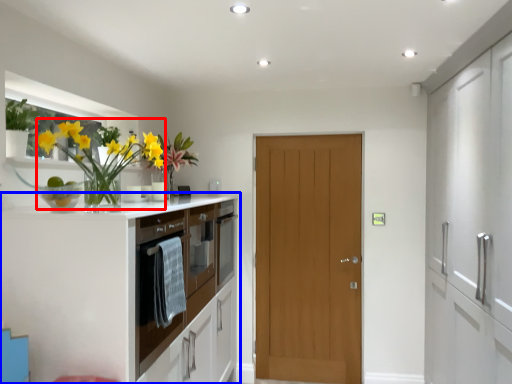
Question: Which of the following is the farthest to the observer, floral arrangement (highlighted by a red box) or cabinetry (highlighted by a blue box)?

Choices:
 (A) floral arrangement
 (B) cabinetry

Answer: (B)